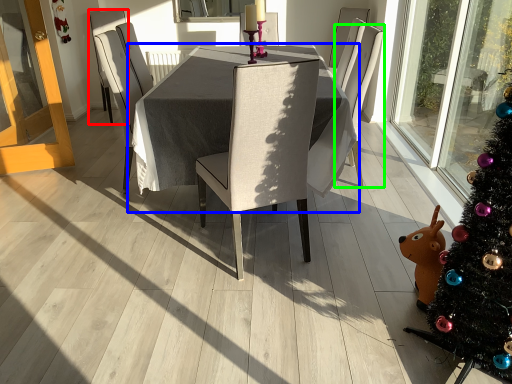
Question: Which is nearer to the chair (highlighted by a red box)? table (highlighted by a blue box) or chair (highlighted by a green box).

Choices:
 (A) table
 (B) chair

Answer: (A)